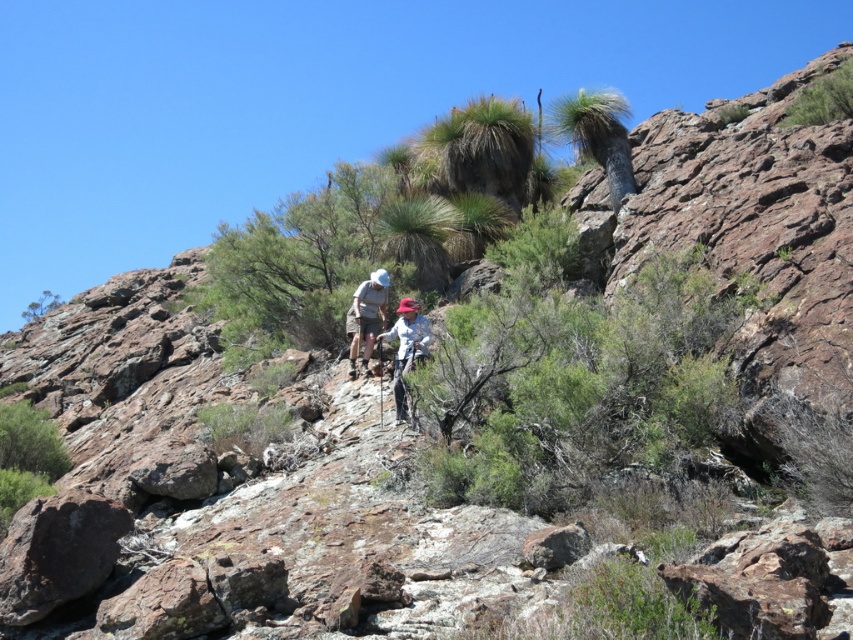
Does point (360, 326) come closer to viewer compared to point (402, 416)?

No.

Locate an element on the screen. This screenshot has height=640, width=853. light brown fabric shirt at center is located at coordinates (366, 317).

Which is in front, point (379, 269) or point (392, 332)?

Positioned in front is point (392, 332).

At what (x,y) coordinates should I click in order to perform the action: click on light brown fabric shirt at center. Please return your answer as a coordinate pair (x, y). The image size is (853, 640). Looking at the image, I should click on (366, 317).